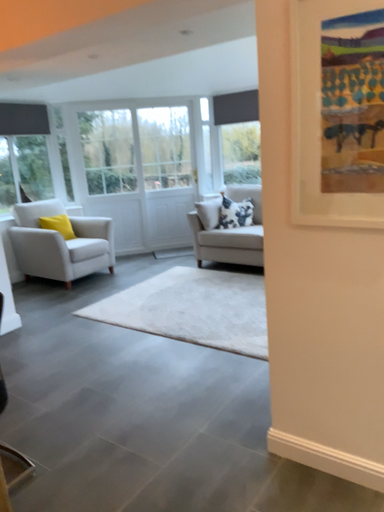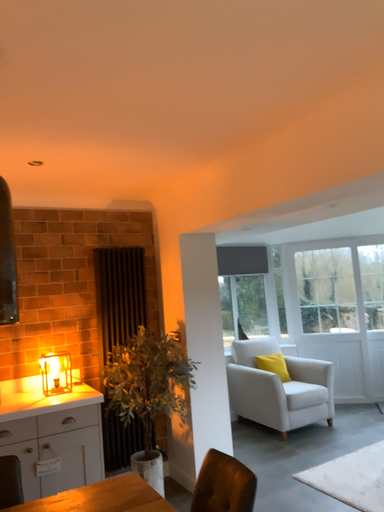
Question: How did the camera likely rotate when shooting the video?

Choices:
 (A) rotated downward
 (B) rotated upward

Answer: (B)